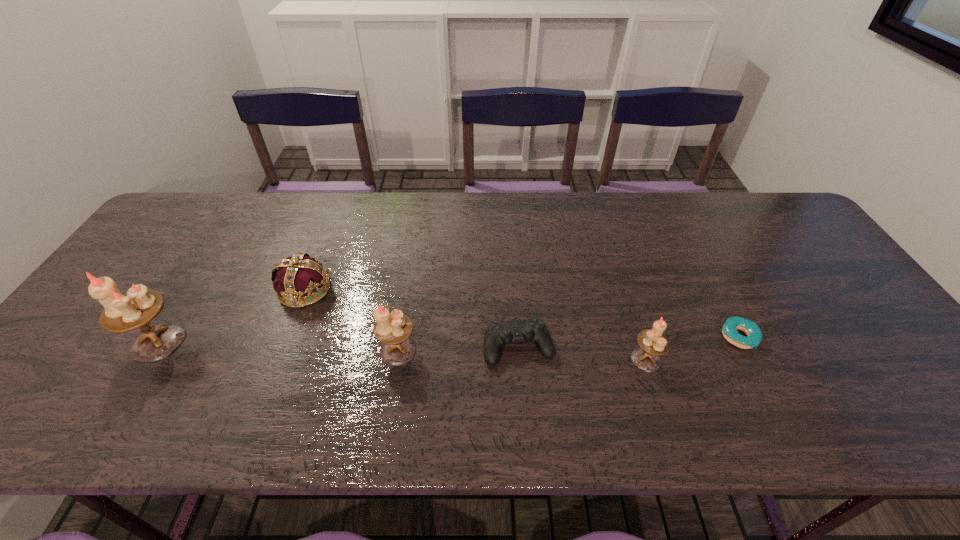
Locate an element on the screen. Image resolution: width=960 pixels, height=540 pixels. free space that is in between the doughnut and the shortest candle holder is located at coordinates (692, 348).

Image resolution: width=960 pixels, height=540 pixels. What are the coordinates of `free space that is in between the fourth object from right to left and the doughnut` in the screenshot? It's located at (568, 344).

Locate an element on the screen. This screenshot has width=960, height=540. free spot between the doughnut and the second object from right to left is located at coordinates (692, 348).

The height and width of the screenshot is (540, 960). Find the location of `free spot between the tallest candle holder and the fourth tallest object`. free spot between the tallest candle holder and the fourth tallest object is located at coordinates [231, 316].

Where is `empty location between the fifth object from right to left and the shortest object`? The width and height of the screenshot is (960, 540). empty location between the fifth object from right to left and the shortest object is located at coordinates (522, 313).

You are a GUI agent. You are given a task and a screenshot of the screen. Output one action in this format:
    pyautogui.click(x=<x>, y=<y>)
    Task: Click on the object that stands as the closest to the second object from left to right
    
    Given the screenshot: What is the action you would take?
    pyautogui.click(x=139, y=306)

This screenshot has width=960, height=540. Find the location of `object identified as the third closest to the control`. object identified as the third closest to the control is located at coordinates (300, 275).

Identify which candle holder is located as the nearest to the farthest object. Please provide its 2D coordinates. Your answer should be formatted as a tuple, i.e. [(x, y)], where the tuple contains the x and y coordinates of a point satisfying the conditions above.

[(139, 306)]

Image resolution: width=960 pixels, height=540 pixels. What are the coordinates of `candle holder object that ranks as the third closest to the doughnut` in the screenshot? It's located at (139, 306).